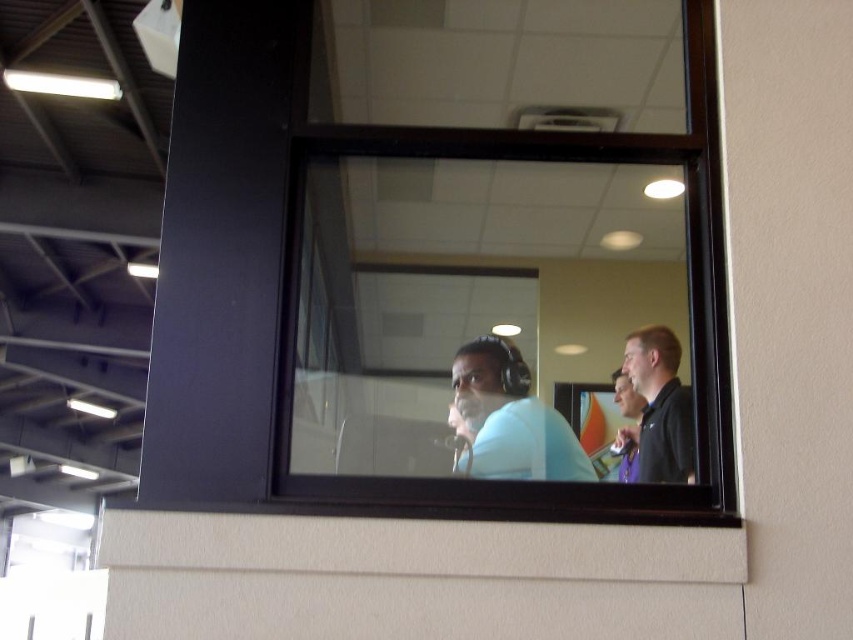
Is transparent glass window at center positioned at the back of black matte shirt at right?

No.

Is transparent glass window at center taller than black matte shirt at right?

Yes.

Is point (682, 291) closer to camera compared to point (657, 342)?

No, it is not.

This screenshot has height=640, width=853. What are the coordinates of `transparent glass window at center` in the screenshot? It's located at (494, 310).

What do you see at coordinates (494, 310) in the screenshot? The width and height of the screenshot is (853, 640). I see `transparent glass window at center` at bounding box center [494, 310].

Which is in front, point (430, 131) or point (480, 346)?

Point (480, 346) is in front.

Is point (688, 195) closer to camera compared to point (469, 420)?

No.

At what (x,y) coordinates should I click in order to perform the action: click on transparent glass window at center. Please return your answer as a coordinate pair (x, y). Looking at the image, I should click on (494, 310).

Does matte blue shirt at center have a greater width compared to black matte shirt at right?

Yes, matte blue shirt at center is wider than black matte shirt at right.

Is point (508, 406) closer to camera compared to point (685, 476)?

That is False.

At what (x,y) coordinates should I click in order to perform the action: click on matte blue shirt at center. Please return your answer as a coordinate pair (x, y). The height and width of the screenshot is (640, 853). Looking at the image, I should click on (509, 417).